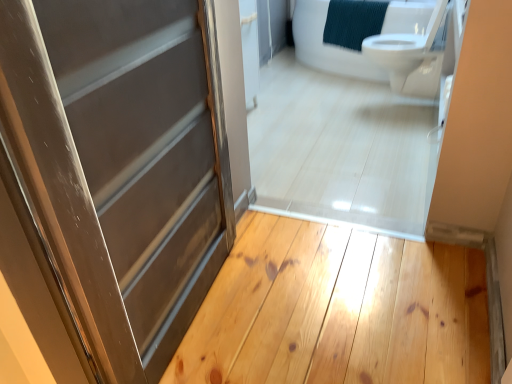
Question: Considering the relative sizes of matte gray door at center and light brown wood plank at center in the image provided, is matte gray door at center smaller than light brown wood plank at center?

Choices:
 (A) no
 (B) yes

Answer: (A)

Question: Considering the relative positions of matte gray door at center and light brown wood plank at center in the image provided, is matte gray door at center to the right of light brown wood plank at center from the viewer's perspective?

Choices:
 (A) yes
 (B) no

Answer: (B)

Question: Is matte gray door at center far away from light brown wood plank at center?

Choices:
 (A) yes
 (B) no

Answer: (B)

Question: Does matte gray door at center appear on the left side of light brown wood plank at center?

Choices:
 (A) yes
 (B) no

Answer: (A)

Question: Is matte gray door at center shorter than light brown wood plank at center?

Choices:
 (A) yes
 (B) no

Answer: (B)

Question: Is light brown wood plank at center inside or outside of white glossy toilet at upper right?

Choices:
 (A) inside
 (B) outside

Answer: (B)

Question: Is point (388, 319) closer or farther from the camera than point (414, 62)?

Choices:
 (A) farther
 (B) closer

Answer: (B)

Question: From the image's perspective, is light brown wood plank at center above or below white glossy toilet at upper right?

Choices:
 (A) above
 (B) below

Answer: (B)

Question: From their relative heights in the image, would you say light brown wood plank at center is taller or shorter than white glossy toilet at upper right?

Choices:
 (A) short
 (B) tall

Answer: (A)

Question: Looking at their shapes, would you say light brown wood plank at center is wider or thinner than matte gray door at center?

Choices:
 (A) thin
 (B) wide

Answer: (B)

Question: Is point (413, 276) positioned closer to the camera than point (129, 114)?

Choices:
 (A) farther
 (B) closer

Answer: (A)

Question: In the image, is light brown wood plank at center on the left side or the right side of matte gray door at center?

Choices:
 (A) left
 (B) right

Answer: (B)

Question: Considering their positions, is light brown wood plank at center located in front of or behind matte gray door at center?

Choices:
 (A) behind
 (B) front

Answer: (A)

Question: Looking at their shapes, would you say white glossy toilet at upper right is wider or thinner than light brown wood plank at center?

Choices:
 (A) wide
 (B) thin

Answer: (B)

Question: Is point (415, 54) closer or farther from the camera than point (372, 364)?

Choices:
 (A) farther
 (B) closer

Answer: (A)